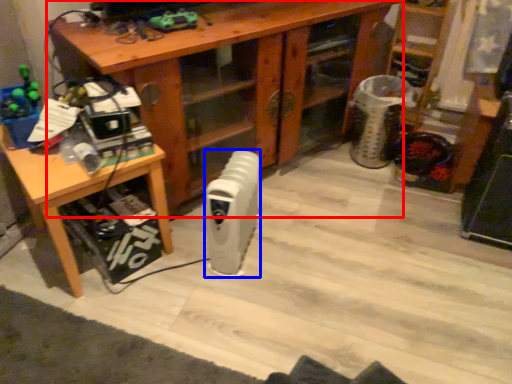
Question: Which of the following is the farthest to the observer, desk (highlighted by a red box) or radiator (highlighted by a blue box)?

Choices:
 (A) desk
 (B) radiator

Answer: (B)